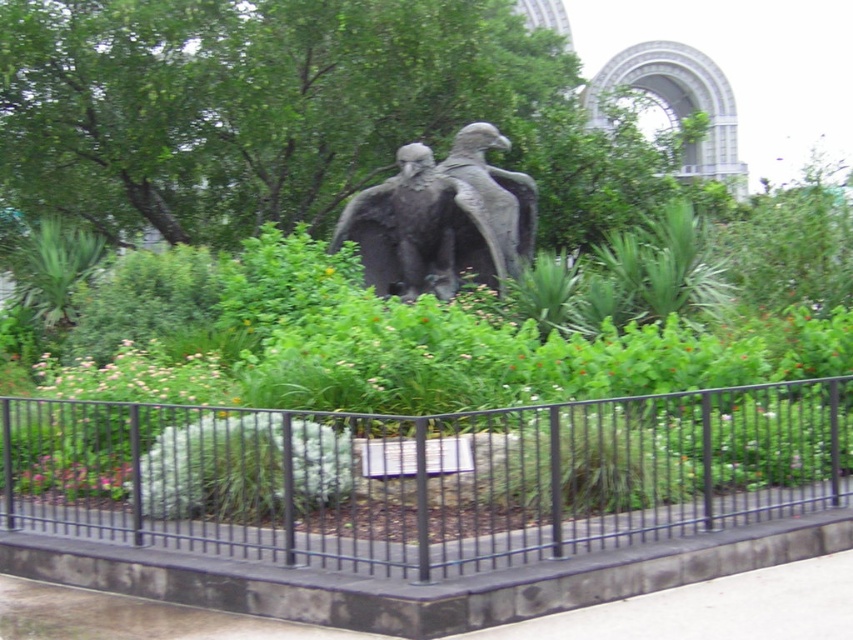
You are a landscape architect designing a garden pathway that needs to pass between the green leafy tree at center and the gray stone eagle at center. Based on their heights, which object will likely require more clearance for taller vehicles passing through?

The gray stone eagle at center is taller than the green leafy tree at center, so it will require more clearance for taller vehicles passing through.

You are standing at the point marked as point (424, 476) in the image. What object are you currently standing on?

You are standing on the black metal fence at center.

You are a gardener trying to plant a new shrub that requires 1 meter of space. You have a spot between the black metal fence at center and the green leafy bush at center. Can you determine if there is enough space for the new shrub based on the available information?

The black metal fence at center might be wider than green leafy bush at center, so there might not be enough space for the new shrub that requires 1 meter of space between them. Please check the actual distance before planting.